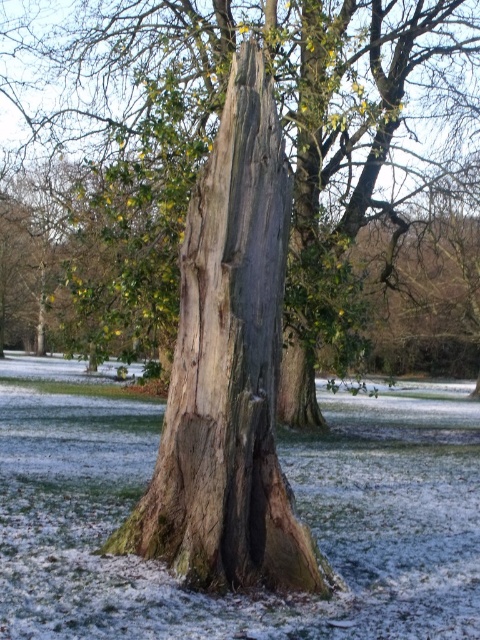
Does smooth bark tree trunk at center have a greater height compared to weathered wood tree trunk at center?

Indeed, smooth bark tree trunk at center has a greater height compared to weathered wood tree trunk at center.

Between smooth bark tree trunk at center and weathered wood tree trunk at center, which one is positioned higher?

smooth bark tree trunk at center is above.

Does point (52, 301) lie in front of point (242, 308)?

No, it is not.

The width and height of the screenshot is (480, 640). What are the coordinates of `smooth bark tree trunk at center` in the screenshot? It's located at (207, 150).